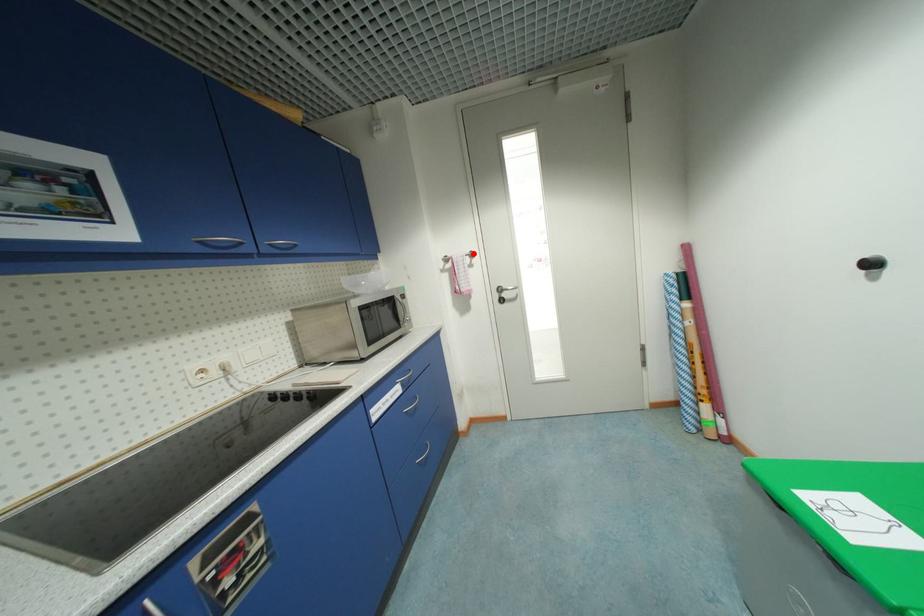
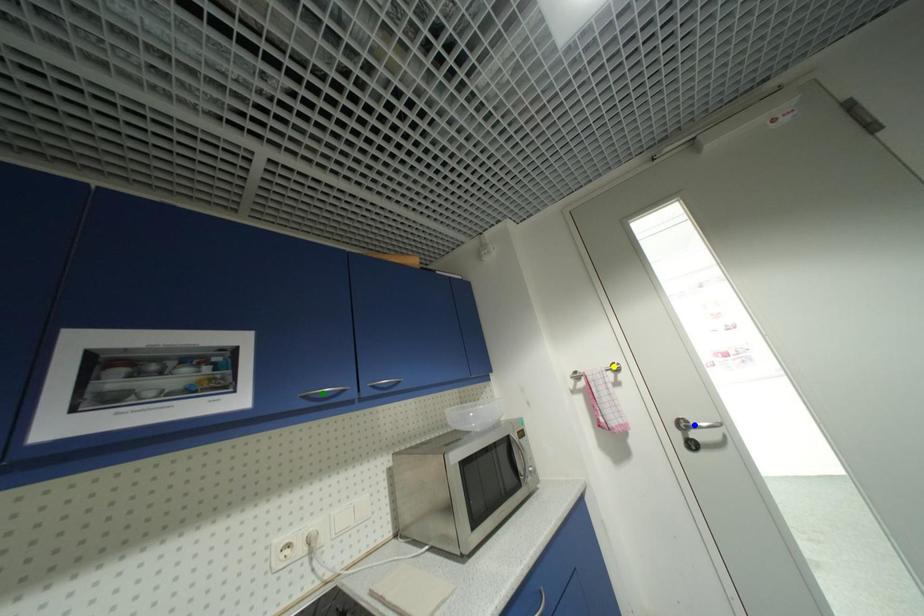
Question: I am providing you with two images of the same scene from different viewpoints. A red point is marked on the first image. You are given multiple points on the second image. In image 2, which mark is for the same physical point as the one in image 1?

Choices:
 (A) yellow point
 (B) blue point
 (C) green point

Answer: (A)